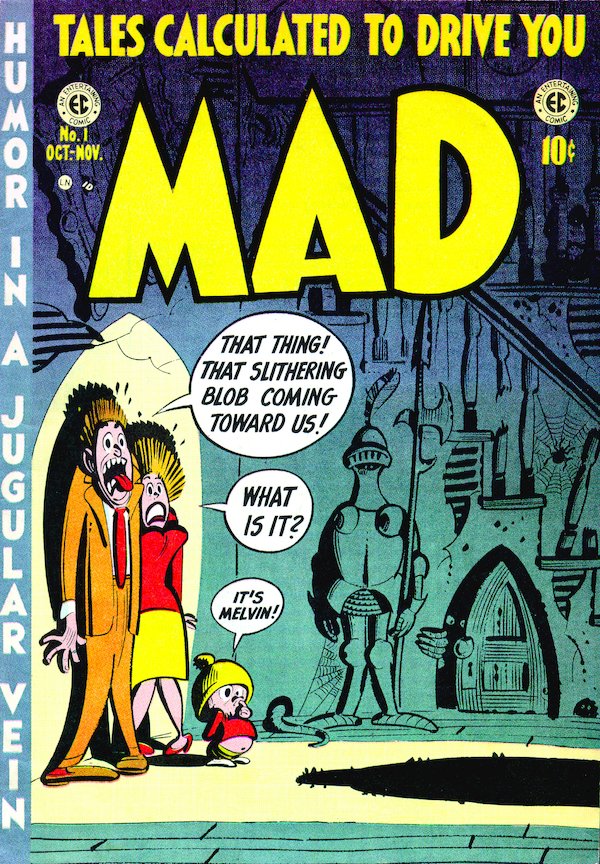
Image resolution: width=600 pixels, height=864 pixels. I want to click on wood floor, so click(x=161, y=837), click(x=475, y=726).